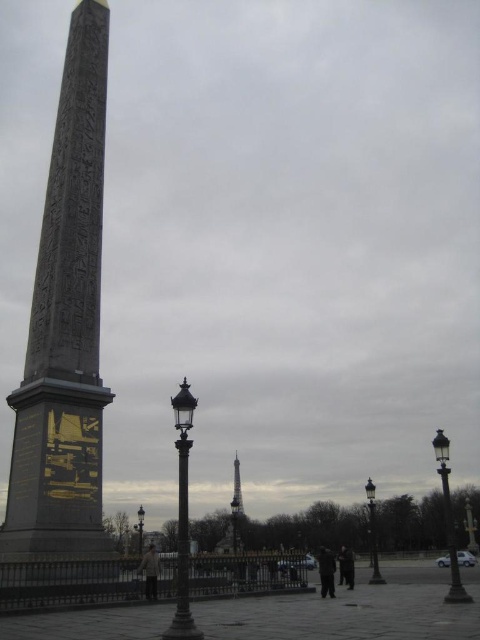
Question: Does light beige sweater at center appear on the right side of dark gray fabric pants at center?

Choices:
 (A) yes
 (B) no

Answer: (B)

Question: Does black polished stone obelisk at left come behind dark gray jacket at lower center?

Choices:
 (A) yes
 (B) no

Answer: (B)

Question: Which object is positioned closest to the dark gray fabric pants at center?

Choices:
 (A) black polished stone obelisk at left
 (B) dark gray jacket at lower center

Answer: (B)

Question: Which object is closer to the camera taking this photo?

Choices:
 (A) dark gray jacket at lower center
 (B) dark gray fabric pants at center
 (C) light beige sweater at center
 (D) black polished stone obelisk at left

Answer: (D)

Question: Which object appears farthest from the camera in this image?

Choices:
 (A) dark gray fabric pants at center
 (B) light beige sweater at center
 (C) dark gray jacket at lower center
 (D) black polished stone obelisk at left

Answer: (C)

Question: Is light beige sweater at center bigger than dark gray fabric pants at center?

Choices:
 (A) yes
 (B) no

Answer: (B)